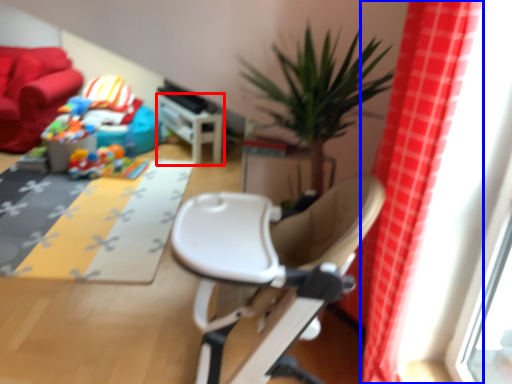
Question: Which object is further to the camera taking this photo, table (highlighted by a red box) or curtain (highlighted by a blue box)?

Choices:
 (A) table
 (B) curtain

Answer: (A)